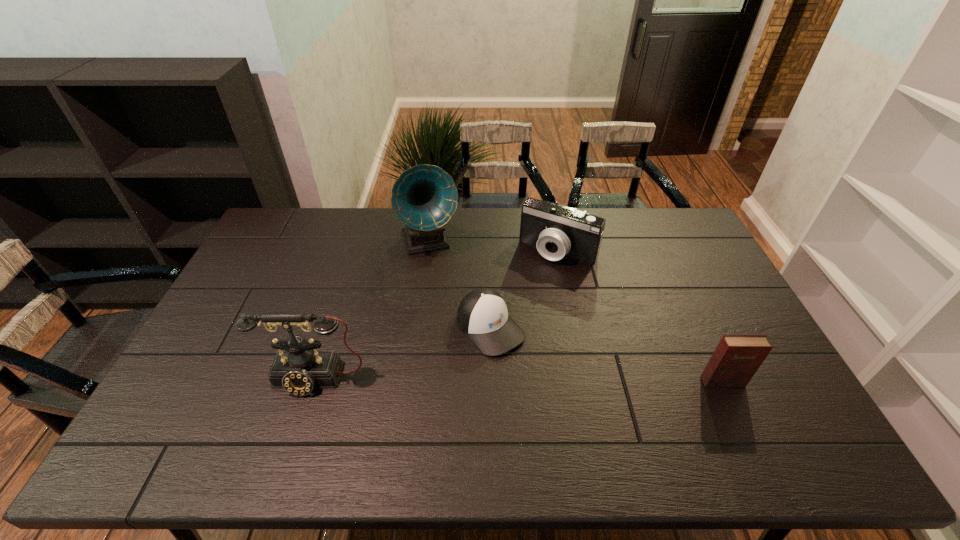
Where is `vacant space located 0.300m on the lens of the camcorder`? The width and height of the screenshot is (960, 540). vacant space located 0.300m on the lens of the camcorder is located at coordinates (504, 325).

This screenshot has width=960, height=540. In order to click on vacant space located on the lens of the camcorder in this screenshot , I will do `click(513, 312)`.

Locate an element on the screen. The height and width of the screenshot is (540, 960). vacant area situated 0.240m from the horn of the tallest object is located at coordinates (453, 313).

At what (x,y) coordinates should I click in order to perform the action: click on free space located from the horn of the tallest object. Please return your answer as a coordinate pair (x, y). This screenshot has height=540, width=960. Looking at the image, I should click on (464, 345).

You are a GUI agent. You are given a task and a screenshot of the screen. Output one action in this format:
    pyautogui.click(x=<x>, y=<y>)
    Task: Click on the vacant space located 0.300m from the horn of the tallest object
    
    Given the screenshot: What is the action you would take?
    pyautogui.click(x=458, y=327)

Identify the location of vacant space located on the front panel of the third nearest object. (564, 410).

Where is `vacant space located 0.170m on the front panel of the third nearest object`? This screenshot has width=960, height=540. vacant space located 0.170m on the front panel of the third nearest object is located at coordinates (551, 395).

Locate an element on the screen. This screenshot has width=960, height=540. vacant space located on the front panel of the third nearest object is located at coordinates (559, 404).

Identify the location of camcorder located in the far edge section of the desktop. (557, 231).

Identify the location of phonograph_record at the far edge. (424, 197).